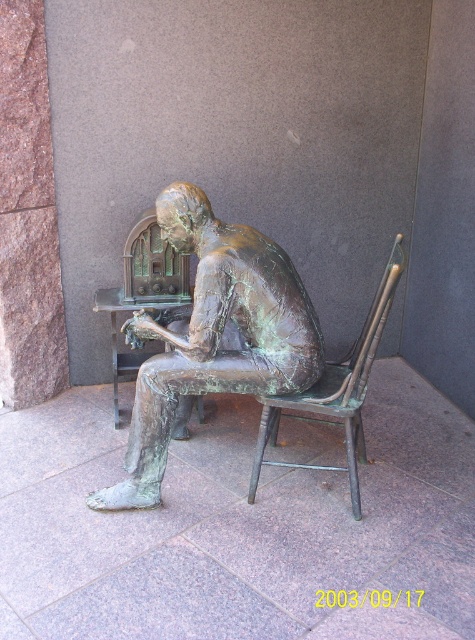
How far apart are green patina metal chair at center and green patina wood chair at center?

green patina metal chair at center is 28.72 inches away from green patina wood chair at center.

Does green patina metal chair at center have a smaller size compared to green patina wood chair at center?

No, green patina metal chair at center is not smaller than green patina wood chair at center.

Find the location of a particular element. The width and height of the screenshot is (475, 640). green patina metal chair at center is located at coordinates (336, 388).

Does green patina bronze statue at center appear over green patina wood chair at center?

No.

Between green patina bronze statue at center and green patina wood chair at center, which one is positioned lower?

green patina bronze statue at center is lower down.

Where is `green patina bronze statue at center`? This screenshot has height=640, width=475. green patina bronze statue at center is located at coordinates (214, 337).

Is green patina bronze statue at center further to the viewer compared to green patina metal chair at center?

That is True.

Does green patina bronze statue at center appear under green patina metal chair at center?

Actually, green patina bronze statue at center is above green patina metal chair at center.

Which is in front, point (140, 371) or point (363, 445)?

Point (140, 371) is in front.

Find the location of a particular element. The image size is (475, 640). green patina bronze statue at center is located at coordinates (214, 337).